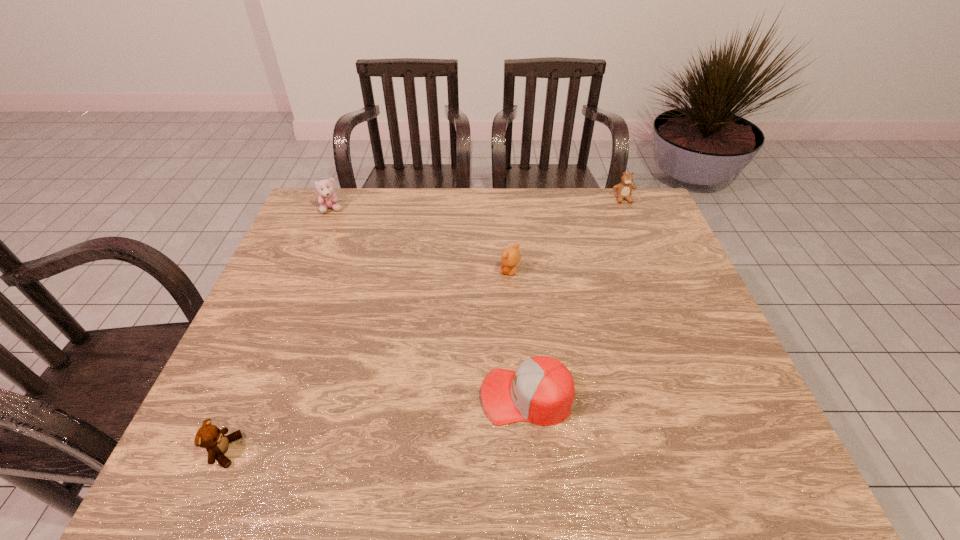
I want to click on free region at the left edge, so click(296, 261).

Find the location of a particular element. vacant point at the right edge is located at coordinates click(639, 246).

Identify the location of vacant area between the rightmost object and the second nearest object. The height and width of the screenshot is (540, 960). (575, 298).

Locate an element on the screen. Image resolution: width=960 pixels, height=540 pixels. vacant area that lies between the third farthest object and the fourth farthest object is located at coordinates (518, 334).

Identify the location of free spot between the baseball cap and the nearest object. The height and width of the screenshot is (540, 960). (375, 423).

Locate an element on the screen. free point between the baseball cap and the rightmost teddy bear is located at coordinates (575, 298).

The height and width of the screenshot is (540, 960). Find the location of `object that can be found as the fourth closest to the nearest object`. object that can be found as the fourth closest to the nearest object is located at coordinates (624, 189).

The height and width of the screenshot is (540, 960). What are the coordinates of `object that is the third closest to the third farthest object` in the screenshot? It's located at (327, 199).

You are a GUI agent. You are given a task and a screenshot of the screen. Output one action in this format:
    pyautogui.click(x=<x>, y=<y>)
    Task: Click on the teddy bear that is the second closest to the nearest teddy bear
    
    Given the screenshot: What is the action you would take?
    pyautogui.click(x=327, y=199)

Where is `teddy bear that stands as the closest to the rightmost object`? The width and height of the screenshot is (960, 540). teddy bear that stands as the closest to the rightmost object is located at coordinates (511, 256).